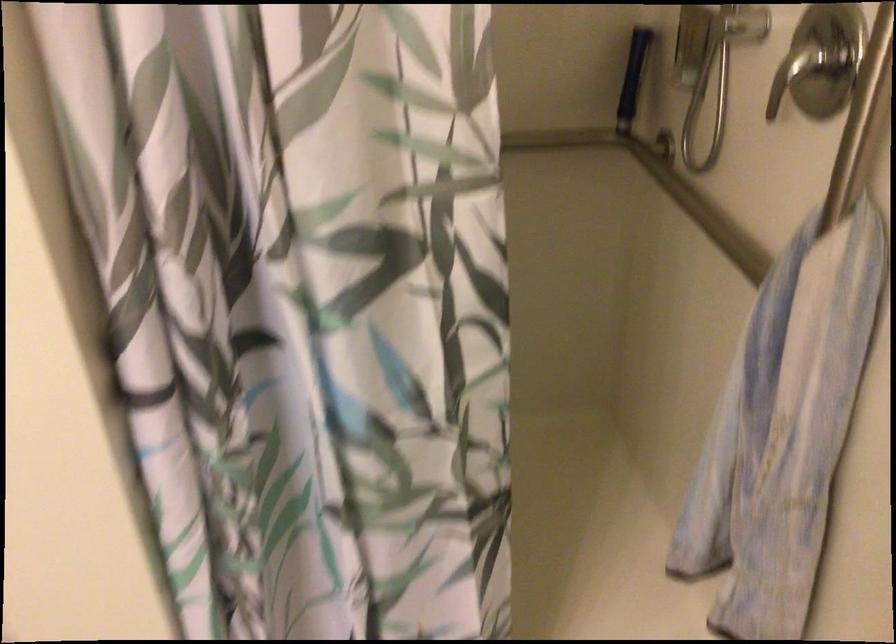
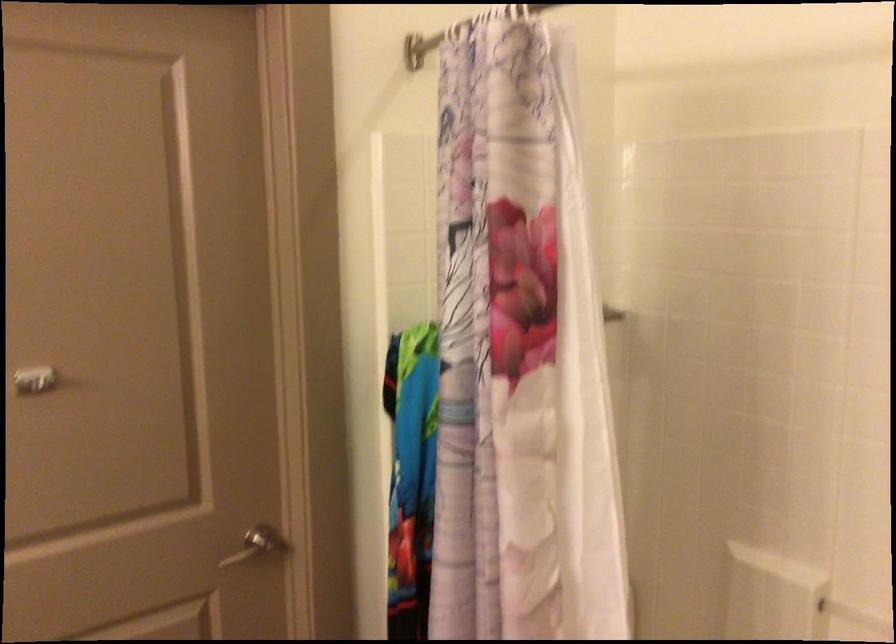
Question: The first image is from the beginning of the video and the second image is from the end. How did the camera likely rotate when shooting the video?

Choices:
 (A) Left
 (B) Right
 (C) Up
 (D) Down

Answer: (A)